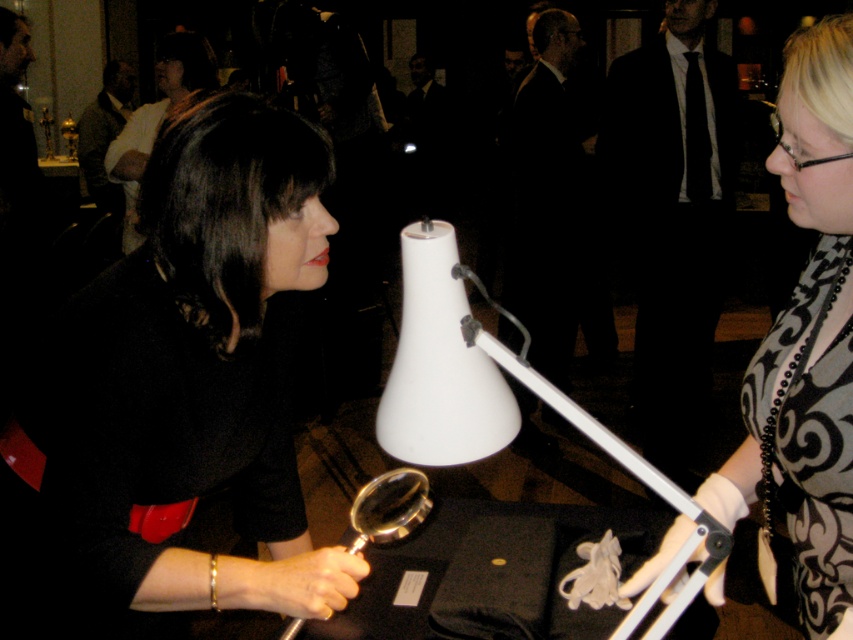
Question: Which object is positioned farthest from the black matte dress at center?

Choices:
 (A) silver metallic magnifying glass at center
 (B) patterned fabric dress at center
 (C) white plastic lamp at center
 (D) matte black dress at center

Answer: (D)

Question: Which of the following is the closest to the observer?

Choices:
 (A) (393, 483)
 (B) (297, 516)

Answer: (A)

Question: Which object is positioned closest to the patterned fabric dress at center?

Choices:
 (A) black matte dress at center
 (B) white plastic lamp at center
 (C) silver metallic magnifying glass at center

Answer: (B)

Question: Observing the image, what is the correct spatial positioning of black matte dress at center in reference to silver metallic magnifying glass at center?

Choices:
 (A) right
 (B) left

Answer: (B)

Question: Is patterned fabric dress at center above white plastic lamp at center?

Choices:
 (A) no
 (B) yes

Answer: (B)

Question: Does black matte dress at center appear on the right side of matte black dress at center?

Choices:
 (A) no
 (B) yes

Answer: (B)